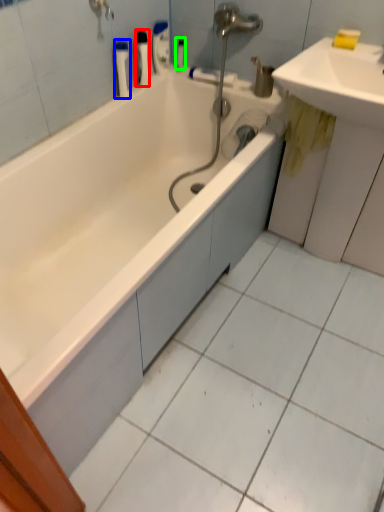
Question: Considering the real-world distances, which object is farthest from toiletry (highlighted by a red box)? toiletry (highlighted by a blue box) or toiletry (highlighted by a green box)?

Choices:
 (A) toiletry
 (B) toiletry

Answer: (B)